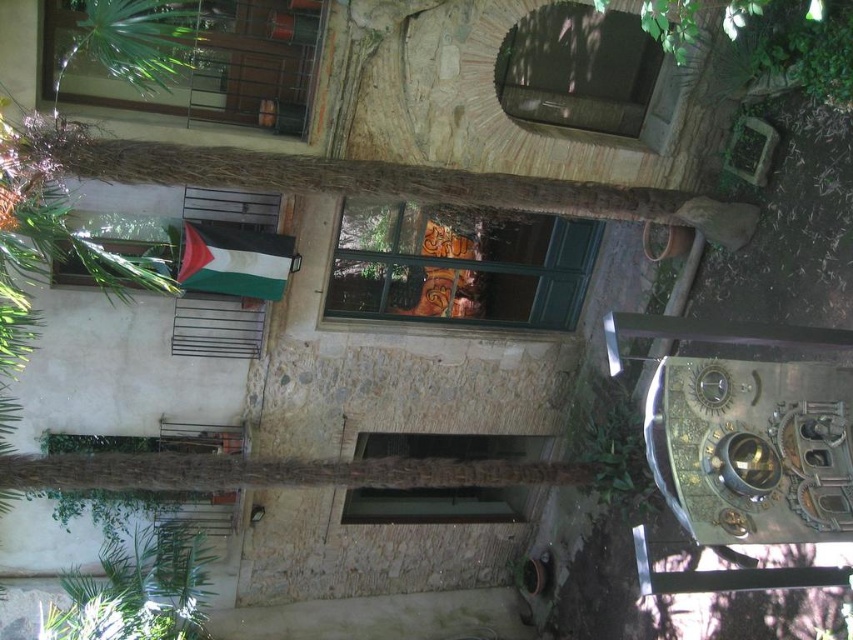
Question: Is the position of green glass window at center less distant than that of green fabric flag at center?

Choices:
 (A) no
 (B) yes

Answer: (A)

Question: Estimate the real-world distances between objects in this image. Which object is closer to the transparent glass window at center?

Choices:
 (A) green-white-red fabric flag at center
 (B) green glass window at center

Answer: (B)

Question: Is green-white-red fabric flag at center above green fabric flag at center?

Choices:
 (A) no
 (B) yes

Answer: (A)

Question: Is green glass window at center wider than metallic balcony at upper left?

Choices:
 (A) no
 (B) yes

Answer: (B)

Question: Which object appears farthest from the camera in this image?

Choices:
 (A) matte glass window at upper center
 (B) green fabric flag at center

Answer: (A)

Question: Which point appears closest to the camera in this image?

Choices:
 (A) (401, 227)
 (B) (177, 260)

Answer: (B)